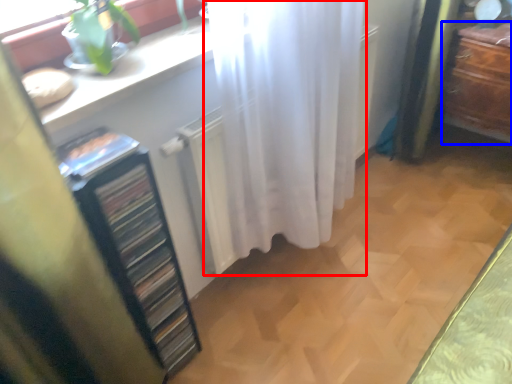
Question: Which point is closer to the camera, curtain (highlighted by a red box) or furniture (highlighted by a blue box)?

Choices:
 (A) curtain
 (B) furniture

Answer: (A)